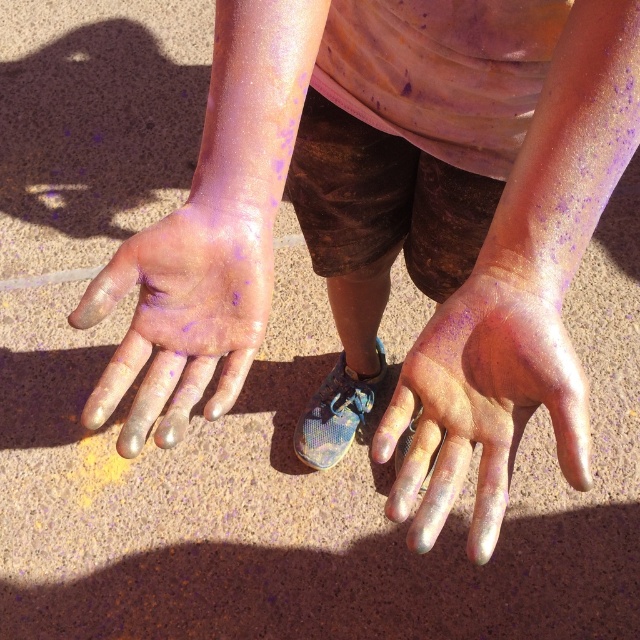
Question: Is iridescent metallic hand at center further to camera compared to shiny metallic hand at center?

Choices:
 (A) no
 (B) yes

Answer: (A)

Question: Which of the following is the farthest from the observer?

Choices:
 (A) (456, 301)
 (B) (227, 323)

Answer: (B)

Question: In this image, where is iridescent metallic hand at center located relative to shiny metallic hand at center?

Choices:
 (A) left
 (B) right

Answer: (B)

Question: Does iridescent metallic hand at center have a lesser width compared to shiny metallic hand at center?

Choices:
 (A) yes
 (B) no

Answer: (A)

Question: Which point is closer to the camera?

Choices:
 (A) (492, 529)
 (B) (205, 278)

Answer: (A)